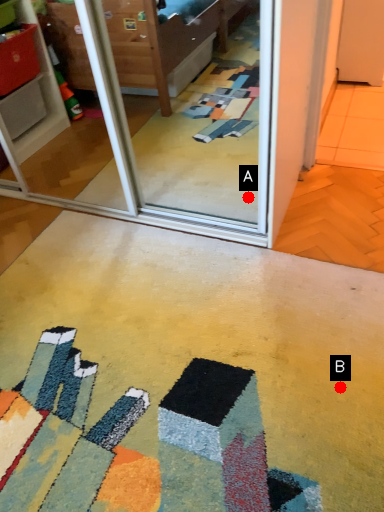
Question: Two points are circled on the image, labeled by A and B beside each circle. Among these points, which one is nearest to the camera?

Choices:
 (A) A is closer
 (B) B is closer

Answer: (B)